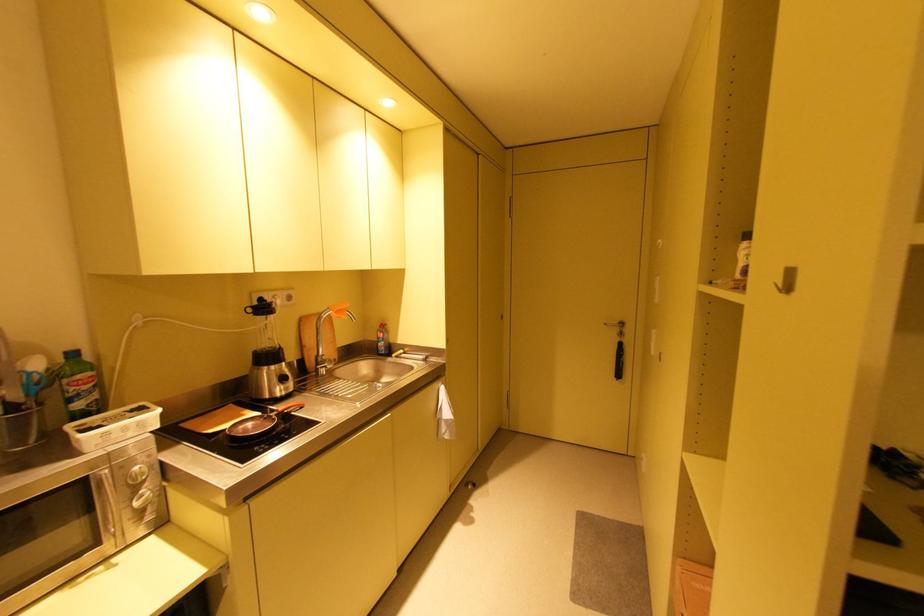
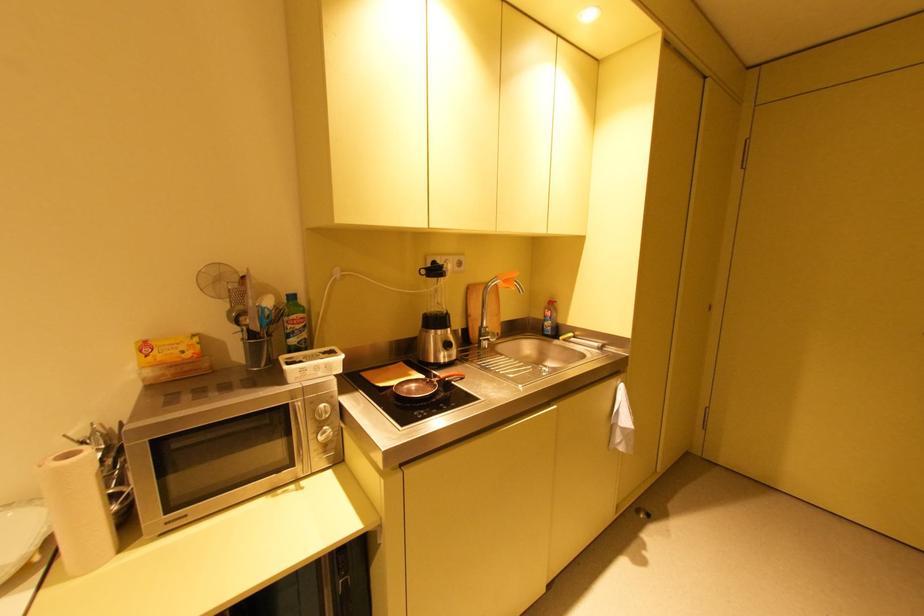
Locate, in the second image, the point that corresponds to [257,424] in the first image.

(420, 387)